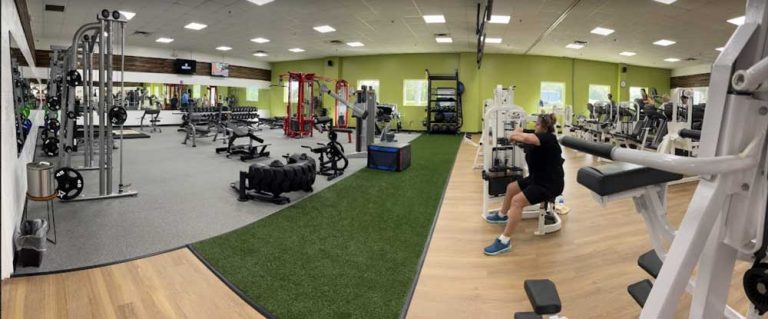
This screenshot has height=319, width=768. I want to click on trash bag, so click(21, 239).